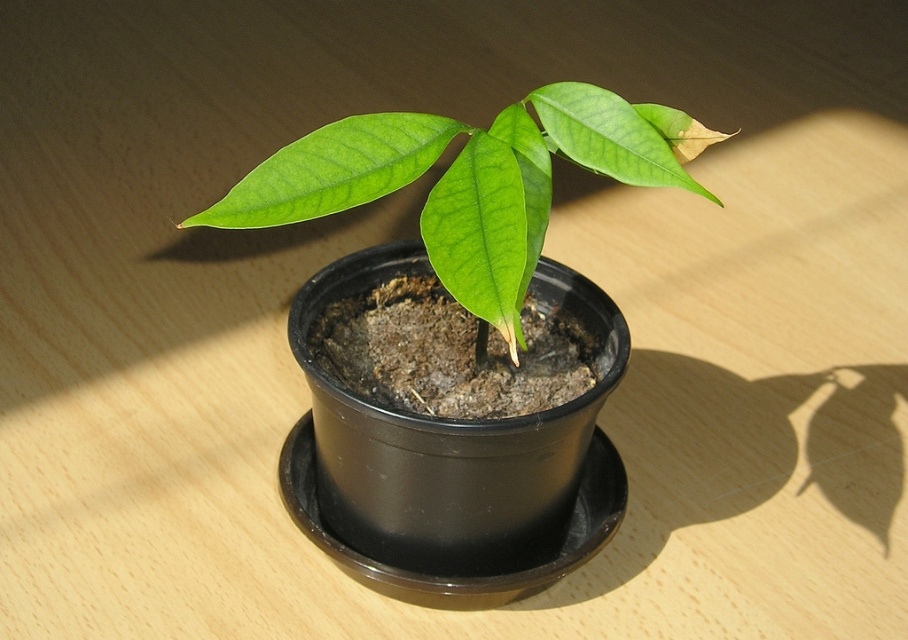
You are an interior designer arranging plants on a desk. You have two leaves on the same plant at the center of the pot. Which leaf is closer to you, the green matte leaf at center or the green glossy leaf at center?

The green matte leaf at center is closer to you because the green glossy leaf at center is positioned behind it.

You are organizing a plant care session and need to identify the position of the leaves. Which leaf is positioned lower between the green matte leaf at center and the green matte leaf at upper center?

The green matte leaf at center is positioned lower than the green matte leaf at upper center.

Consider the image. You are standing in front of the potted plant and want to place a small decorative stone at point A and point B. If point A is at coordinates point (x=514, y=164) and point B is at coordinates point (x=654, y=150), which point is closer to you?

Point point (x=514, y=164) is in front of point point (x=654, y=150), so point A is closer to you.